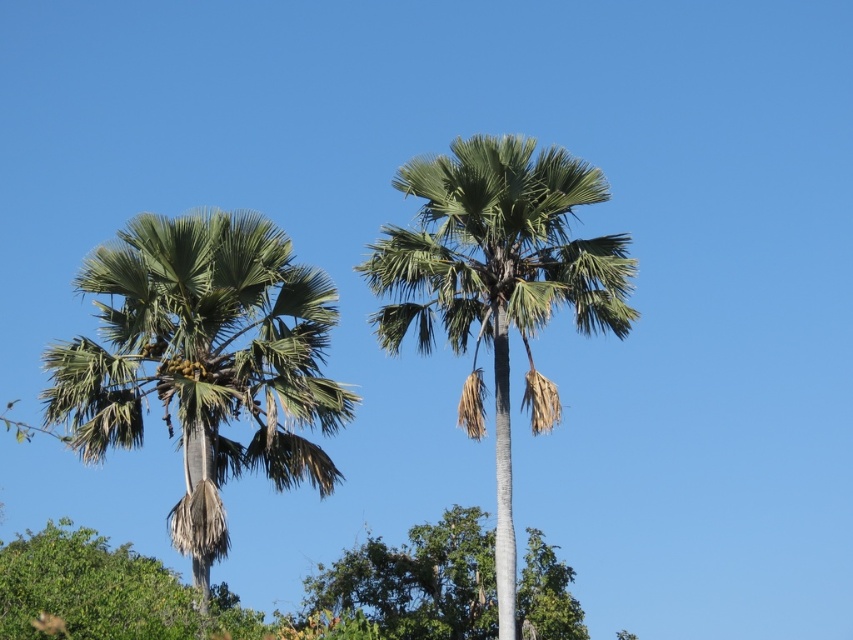
In the scene shown: You are standing in front of two palm trees. You notice two points marked in the scene. The first point is at coordinate point (56, 349) and the second is at point (421, 557). Which point is closer to you?

Point (56, 349) is closer to the viewer than point (421, 557).

You are a bird looking for a nesting spot. You see the green leafy palm at center and the green leafy tree at center. Which one has a bigger canopy for you to build your nest?

The green leafy palm at center is larger in size than the green leafy tree at center, so the palm offers a bigger canopy for nesting.

You are a gardener standing between the green leafy palm at left and the green leafy palm at center. You need to water both trees using a hose that can reach 30 feet. Can you water both trees without moving the hose? Please explain your reasoning.

The distance between the green leafy palm at left and the green leafy palm at center is 36.02 feet. Since the hose can only reach 30 feet, you cannot water both trees without moving the hose. You would need to move the hose to reach the farther tree.